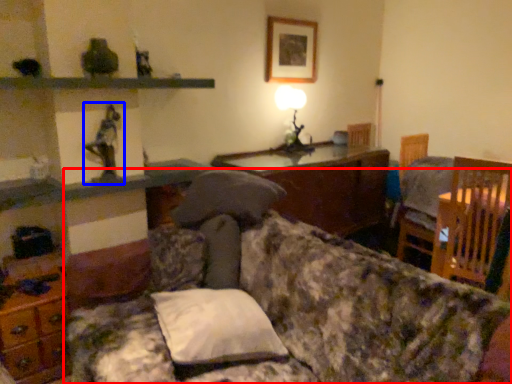
Question: Which object is further to the camera taking this photo, studio couch (highlighted by a red box) or toy (highlighted by a blue box)?

Choices:
 (A) studio couch
 (B) toy

Answer: (B)